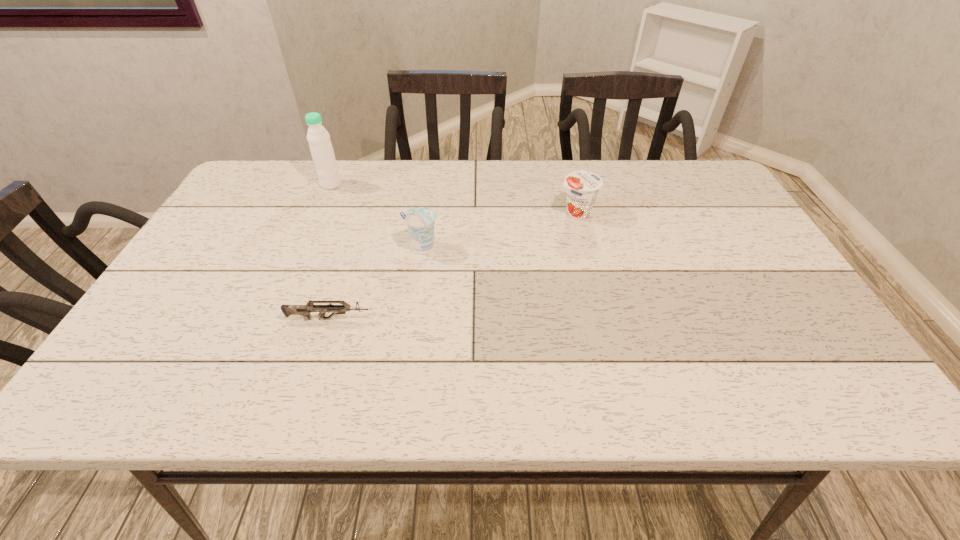
Where is `the tallest object`? This screenshot has width=960, height=540. the tallest object is located at coordinates (318, 137).

Where is `the farthest object`? The height and width of the screenshot is (540, 960). the farthest object is located at coordinates (318, 137).

You are a GUI agent. You are given a task and a screenshot of the screen. Output one action in this format:
    pyautogui.click(x=<x>, y=<y>)
    Task: Click on the right yogurt
    The image size is (960, 540).
    Given the screenshot: What is the action you would take?
    point(582,187)

You are a GUI agent. You are given a task and a screenshot of the screen. Output one action in this format:
    pyautogui.click(x=<x>, y=<y>)
    Task: Click on the rightmost object
    
    Given the screenshot: What is the action you would take?
    pyautogui.click(x=582, y=187)

Locate an element on the screen. the nearer yogurt is located at coordinates (420, 221).

Identify the location of the third object from left to right. click(x=420, y=221).

The image size is (960, 540). In order to click on the shortest object in this screenshot , I will do [304, 310].

At what (x,y) coordinates should I click in order to perform the action: click on the nearest object. Please return your answer as a coordinate pair (x, y). This screenshot has width=960, height=540. Looking at the image, I should click on (304, 310).

Image resolution: width=960 pixels, height=540 pixels. Identify the location of vacant point located on the back of the tallest object. (341, 162).

Locate an element on the screen. vacant space located 0.380m on the left of the right yogurt is located at coordinates (422, 213).